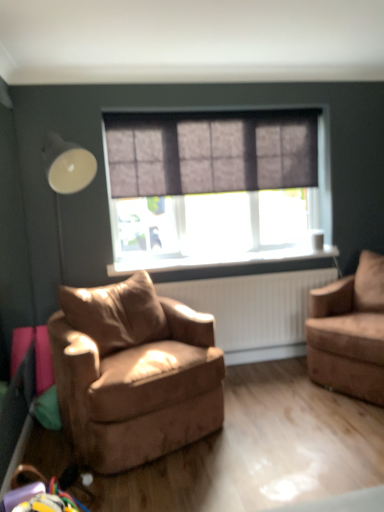
The height and width of the screenshot is (512, 384). What do you see at coordinates (349, 332) in the screenshot?
I see `suede brown armchair at right, the second chair from the left` at bounding box center [349, 332].

Locate an element on the screen. The height and width of the screenshot is (512, 384). suede brown armchair at right, the second chair from the left is located at coordinates (349, 332).

Identify the location of white glossy table lamp at left. (66, 176).

Measure the distance between point (179, 260) and camera.

Point (179, 260) and camera are 11.74 feet apart.

Describe the element at coordinates (133, 373) in the screenshot. I see `brown leather chair at center, the 2th chair viewed from the right` at that location.

This screenshot has width=384, height=512. Identify the location of suede brown armchair at right, the second chair from the left. (349, 332).

Locate an element on the screen. The height and width of the screenshot is (512, 384). curtain on the right of the brown leather chair at center, the 2th chair viewed from the right is located at coordinates (210, 155).

Measure the distance from dark grey textured curtain at center to brown leather chair at center, the 2th chair viewed from the right.

dark grey textured curtain at center is 1.33 meters away from brown leather chair at center, the 2th chair viewed from the right.

Is dark grey textured curtain at center in front of or behind brown leather chair at center, which appears as the 1th chair when viewed from the left, in the image?

Visually, dark grey textured curtain at center is located behind brown leather chair at center, which appears as the 1th chair when viewed from the left.

From the image's perspective, is dark grey textured curtain at center over brown leather chair at center, the 2th chair viewed from the right?

Yes, from the image's perspective, dark grey textured curtain at center is above brown leather chair at center, the 2th chair viewed from the right.

Is black plastic window sill at center inside the boundaries of suede brown armchair at right, the second chair from the left, or outside?

black plastic window sill at center cannot be found inside suede brown armchair at right, the second chair from the left.

Is black plastic window sill at center smaller than suede brown armchair at right, which ranks as the first chair in right-to-left order?

Yes, black plastic window sill at center is smaller than suede brown armchair at right, which ranks as the first chair in right-to-left order.

From a real-world perspective, is black plastic window sill at center on top of suede brown armchair at right, which ranks as the first chair in right-to-left order?

Yes, from a real-world perspective, black plastic window sill at center is on top of suede brown armchair at right, which ranks as the first chair in right-to-left order.

Which object is positioned more to the right, black plastic window sill at center or suede brown armchair at right, the second chair from the left?

suede brown armchair at right, the second chair from the left.

Is white glossy table lamp at left a part of brown leather chair at center, the 2th chair viewed from the right?

No, white glossy table lamp at left is not inside brown leather chair at center, the 2th chair viewed from the right.

Is brown leather chair at center, the 2th chair viewed from the right, positioned far away from white glossy table lamp at left?

Yes, brown leather chair at center, the 2th chair viewed from the right, and white glossy table lamp at left are quite far apart.

Which chair is the 1st one when counting from the right side of the white glossy table lamp at left? Please provide its 2D coordinates.

[(133, 373)]

Is white glossy table lamp at left at the back of brown leather chair at center, the 2th chair viewed from the right?

No.

Would you consider suede brown armchair at right, which ranks as the first chair in right-to-left order, to be distant from white glossy table lamp at left?

suede brown armchair at right, which ranks as the first chair in right-to-left order, is positioned a significant distance from white glossy table lamp at left.

How far apart are suede brown armchair at right, which ranks as the first chair in right-to-left order, and white glossy table lamp at left?

suede brown armchair at right, which ranks as the first chair in right-to-left order, is 2.04 meters away from white glossy table lamp at left.

Which of these two, suede brown armchair at right, which ranks as the first chair in right-to-left order, or white glossy table lamp at left, is bigger?

With larger size is suede brown armchair at right, which ranks as the first chair in right-to-left order.

Is suede brown armchair at right, the second chair from the left, completely or partially outside of white glossy table lamp at left?

suede brown armchair at right, the second chair from the left, is positioned outside white glossy table lamp at left.

Could you measure the distance between suede brown armchair at right, which ranks as the first chair in right-to-left order, and brown leather chair at center, which appears as the 1th chair when viewed from the left?

suede brown armchair at right, which ranks as the first chair in right-to-left order, is 1.22 meters from brown leather chair at center, which appears as the 1th chair when viewed from the left.

Considering their positions, is suede brown armchair at right, the second chair from the left, located in front of or behind brown leather chair at center, the 2th chair viewed from the right?

suede brown armchair at right, the second chair from the left, is positioned farther from the viewer than brown leather chair at center, the 2th chair viewed from the right.

Find the location of a particular element. This screenshot has height=512, width=384. chair that appears above the brown leather chair at center, which appears as the 1th chair when viewed from the left (from a real-world perspective) is located at coordinates (349, 332).

From the image's perspective, is suede brown armchair at right, the second chair from the left, located above or below brown leather chair at center, the 2th chair viewed from the right?

suede brown armchair at right, the second chair from the left, is situated higher than brown leather chair at center, the 2th chair viewed from the right, in the image.

From the dark grey textured curtain at center, count 1st chairs forward and point to it. Please provide its 2D coordinates.

[(349, 332)]

Is dark grey textured curtain at center not close to suede brown armchair at right, the second chair from the left?

Yes.

Is dark grey textured curtain at center taller than suede brown armchair at right, the second chair from the left?

No.

Which is behind, dark grey textured curtain at center or suede brown armchair at right, which ranks as the first chair in right-to-left order?

dark grey textured curtain at center is further from the camera.

Which of these two, black plastic window sill at center or white glossy table lamp at left, is bigger?

white glossy table lamp at left is bigger.

Is black plastic window sill at center beside white glossy table lamp at left?

No, black plastic window sill at center is not in contact with white glossy table lamp at left.

Consider the image. From a real-world perspective, is black plastic window sill at center located beneath white glossy table lamp at left?

Yes, from a real-world perspective, black plastic window sill at center is under white glossy table lamp at left.

Locate an element on the screen. curtain behind the brown leather chair at center, the 2th chair viewed from the right is located at coordinates [210, 155].

Where is `window sill that is above the suede brown armchair at right, the second chair from the left (from a real-world perspective)`? This screenshot has width=384, height=512. window sill that is above the suede brown armchair at right, the second chair from the left (from a real-world perspective) is located at coordinates (231, 262).

Estimate the real-world distances between objects in this image. Which object is further from black plastic window sill at center, brown leather chair at center, the 2th chair viewed from the right, or suede brown armchair at right, which ranks as the first chair in right-to-left order?

The object further to black plastic window sill at center is brown leather chair at center, the 2th chair viewed from the right.

When comparing their distances from dark grey textured curtain at center, does brown leather chair at center, the 2th chair viewed from the right, or suede brown armchair at right, the second chair from the left, seem further?

brown leather chair at center, the 2th chair viewed from the right.

Looking at the image, which one is located further to suede brown armchair at right, which ranks as the first chair in right-to-left order, black plastic window sill at center or white glossy table lamp at left?

white glossy table lamp at left is further to suede brown armchair at right, which ranks as the first chair in right-to-left order.

When comparing their distances from white glossy table lamp at left, does brown leather chair at center, which appears as the 1th chair when viewed from the left, or suede brown armchair at right, the second chair from the left, seem closer?

brown leather chair at center, which appears as the 1th chair when viewed from the left, lies closer to white glossy table lamp at left than the other object.

When comparing their distances from black plastic window sill at center, does dark grey textured curtain at center or brown leather chair at center, which appears as the 1th chair when viewed from the left, seem further?

brown leather chair at center, which appears as the 1th chair when viewed from the left, is positioned further to the anchor black plastic window sill at center.

In the scene shown: Considering their positions, is brown leather chair at center, which appears as the 1th chair when viewed from the left, positioned further to suede brown armchair at right, which ranks as the first chair in right-to-left order, than dark grey textured curtain at center?

Among the two, dark grey textured curtain at center is located further to suede brown armchair at right, which ranks as the first chair in right-to-left order.

Which object lies further to the anchor point black plastic window sill at center, white glossy table lamp at left or dark grey textured curtain at center?

white glossy table lamp at left lies further to black plastic window sill at center than the other object.

Which object lies further to the anchor point suede brown armchair at right, the second chair from the left, black plastic window sill at center or dark grey textured curtain at center?

The object further to suede brown armchair at right, the second chair from the left, is dark grey textured curtain at center.

The width and height of the screenshot is (384, 512). What are the coordinates of `window sill between dark grey textured curtain at center and brown leather chair at center, which appears as the 1th chair when viewed from the left, in the up-down direction` in the screenshot? It's located at (231, 262).

The height and width of the screenshot is (512, 384). In order to click on chair between white glossy table lamp at left and suede brown armchair at right, the second chair from the left, from left to right in this screenshot , I will do `click(133, 373)`.

The width and height of the screenshot is (384, 512). In order to click on curtain situated between white glossy table lamp at left and suede brown armchair at right, which ranks as the first chair in right-to-left order, from left to right in this screenshot , I will do `click(210, 155)`.

At what (x,y) coordinates should I click in order to perform the action: click on window sill between white glossy table lamp at left and suede brown armchair at right, the second chair from the left, in the horizontal direction. Please return your answer as a coordinate pair (x, y). The image size is (384, 512). Looking at the image, I should click on (231, 262).